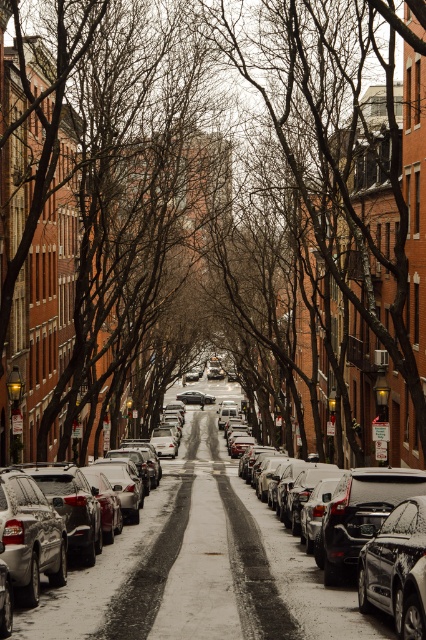
You are a delivery driver trying to navigate through the narrow street. You see a brown leafless tree at center and a silver metallic sedan at center. Which object is closer to the sky?

The brown leafless tree at center is located above the silver metallic sedan at center, so it is closer to the sky.

Looking at this image, you are a delivery driver who needs to park your 1.8 meters wide van in this narrow street. You see the silver metallic sedan at center and the shiny black sedan at center. Can you determine which one has enough space between them for your van?

The silver metallic sedan at center might be wider than shiny black sedan at center, so the space between them may not be sufficient for your 1.8 meters wide van. Check the exact width before attempting to park.